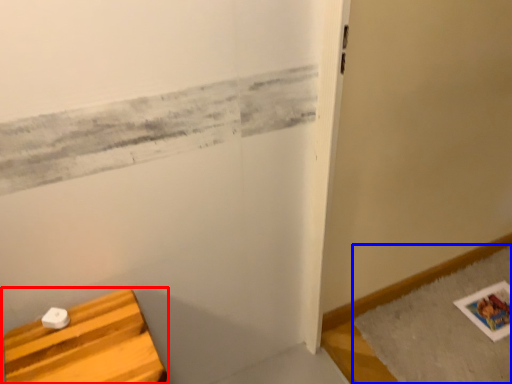
Question: Which object is closer to the camera taking this photo, furniture (highlighted by a red box) or bath mat (highlighted by a blue box)?

Choices:
 (A) furniture
 (B) bath mat

Answer: (A)